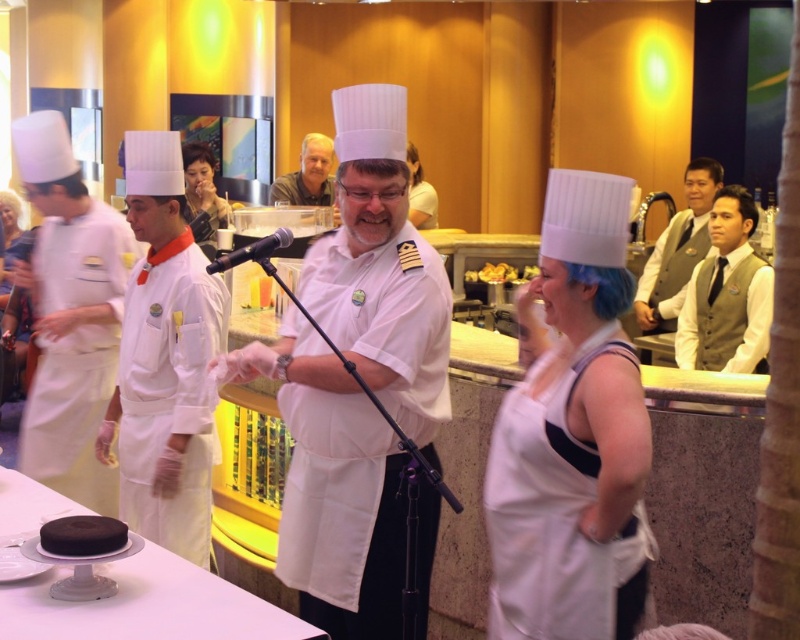
Question: Does white matte uniform at center have a lesser width compared to light brown vest at right?

Choices:
 (A) no
 (B) yes

Answer: (B)

Question: Which point is closer to the camera taking this photo?

Choices:
 (A) (322, 196)
 (B) (350, 131)
 (C) (104, 554)

Answer: (C)

Question: Which object is the closest to the white vest at right?

Choices:
 (A) golden brown bread at center
 (B) smooth skin face at center
 (C) white matte apron at center

Answer: (A)

Question: Which point is closer to the camera taking this photo?

Choices:
 (A) (310, 145)
 (B) (110, 534)
 (C) (218, 264)

Answer: (C)

Question: From the image, what is the correct spatial relationship of white fabric chef's coat at left in relation to light brown vest at right?

Choices:
 (A) right
 (B) left

Answer: (B)

Question: Is light brown vest at right positioned at the back of light brown wood chair at upper center?

Choices:
 (A) no
 (B) yes

Answer: (A)